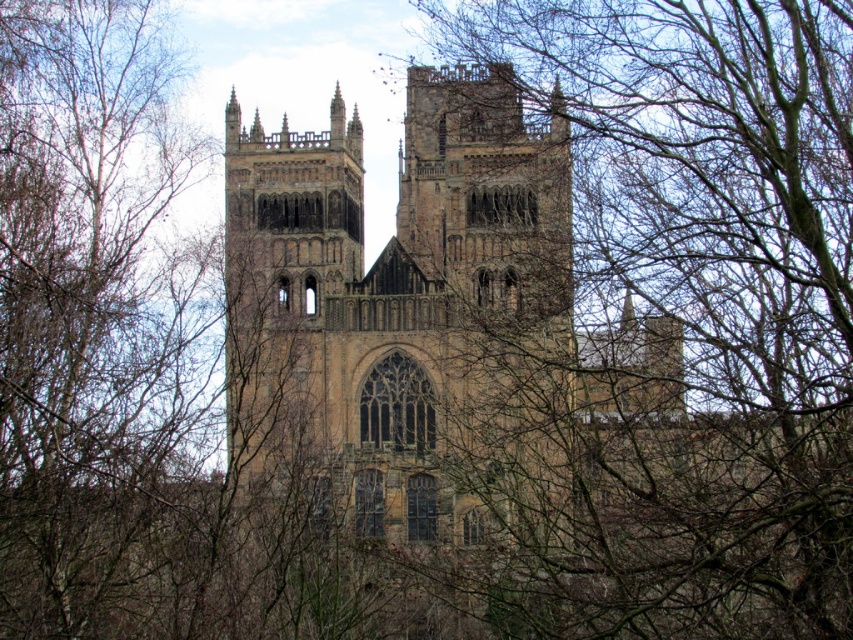
Question: Among these points, which one is farthest from the camera?

Choices:
 (A) (712, 28)
 (B) (506, 378)

Answer: (A)

Question: Is brown leafless branches at upper center bigger than brown stone church at center?

Choices:
 (A) no
 (B) yes

Answer: (B)

Question: Among these objects, which one is nearest to the camera?

Choices:
 (A) brown leafless branches at upper center
 (B) brown stone church at center

Answer: (A)

Question: Is brown leafless branches at upper center smaller than brown stone church at center?

Choices:
 (A) no
 (B) yes

Answer: (A)

Question: Is brown leafless branches at upper center wider than brown stone church at center?

Choices:
 (A) yes
 (B) no

Answer: (B)